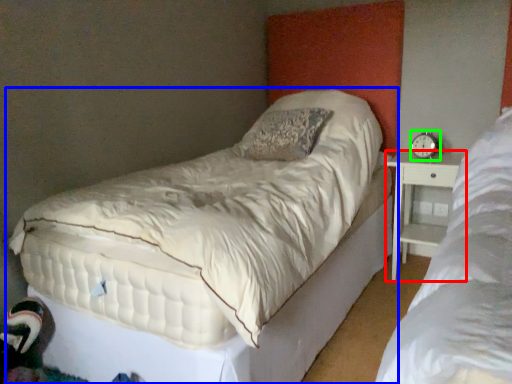
Question: Estimate the real-world distances between objects in this image. Which object is farther from nightstand (highlighted by a red box), bed (highlighted by a blue box) or alarm clock (highlighted by a green box)?

Choices:
 (A) bed
 (B) alarm clock

Answer: (A)